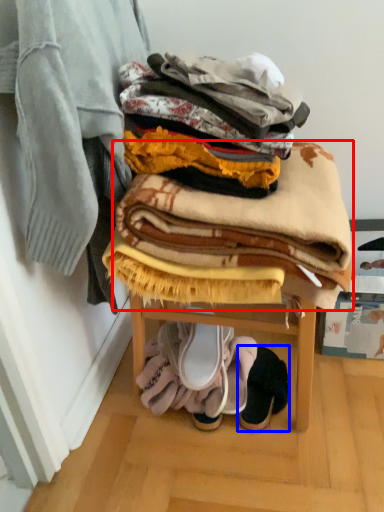
Question: Which object is further to the camera taking this photo, blanket (highlighted by a red box) or footwear (highlighted by a blue box)?

Choices:
 (A) blanket
 (B) footwear

Answer: (B)